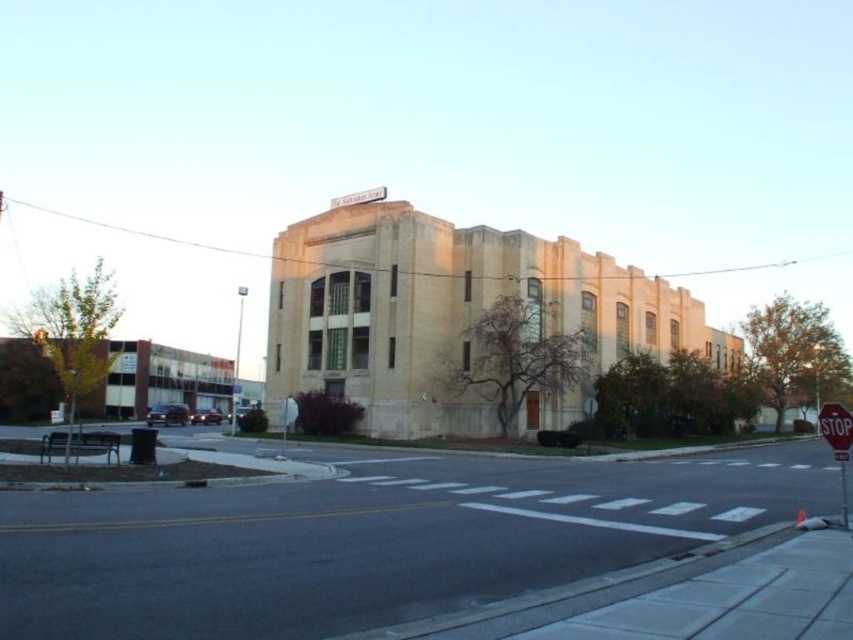
Question: Which object is closer to the camera taking this photo?

Choices:
 (A) white plastic sign at upper center
 (B) red matte stop sign at lower right

Answer: (B)

Question: Which object is closer to the camera taking this photo?

Choices:
 (A) red matte stop sign at lower right
 (B) white plastic sign at upper center

Answer: (A)

Question: Is red matte stop sign at lower right above white plastic sign at upper center?

Choices:
 (A) yes
 (B) no

Answer: (B)

Question: Can you confirm if red matte stop sign at lower right is thinner than white plastic sign at upper center?

Choices:
 (A) yes
 (B) no

Answer: (B)

Question: Can you confirm if red matte stop sign at lower right is wider than white plastic sign at upper center?

Choices:
 (A) no
 (B) yes

Answer: (B)